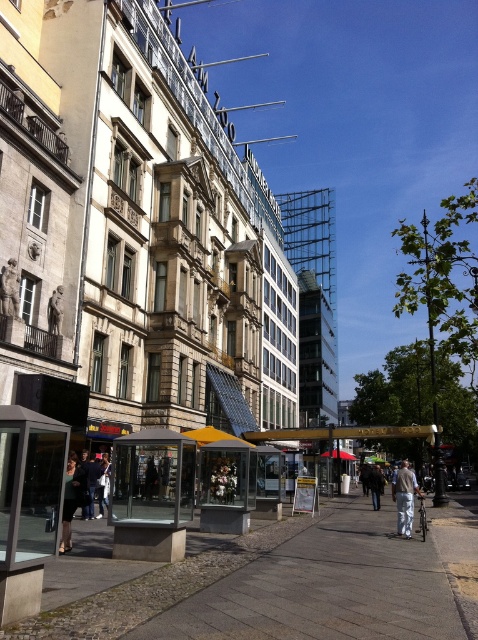
Does light beige pants at center have a greater height compared to dark gray fabric coat at lower left?

Yes.

Who is more distant from viewer, (414, 488) or (72, 516)?

The point (414, 488) is behind.

Measure the distance between point (409, 483) and camera.

The distance of point (409, 483) from camera is 45.66 meters.

You are a GUI agent. You are given a task and a screenshot of the screen. Output one action in this format:
    pyautogui.click(x=<x>, y=<y>)
    Task: Click on the light beige pants at center
    Image resolution: width=478 pixels, height=640 pixels.
    Given the screenshot: What is the action you would take?
    pyautogui.click(x=404, y=497)

Which is more to the left, gray cobblestone pavement at center or light beige pants at center?

gray cobblestone pavement at center is more to the left.

Between gray cobblestone pavement at center and light beige pants at center, which one appears on the right side from the viewer's perspective?

light beige pants at center is more to the right.

Is point (213, 545) farther from viewer compared to point (401, 486)?

No, (213, 545) is closer to viewer.

Image resolution: width=478 pixels, height=640 pixels. In order to click on gray cobblestone pavement at center in this screenshot , I will do `click(273, 582)`.

Can you confirm if transparent glass bus stop at center is thinner than light beige pants at center?

Yes.

Does point (177, 506) come in front of point (410, 477)?

Yes, it is.

This screenshot has height=640, width=478. I want to click on transparent glass bus stop at center, so click(152, 493).